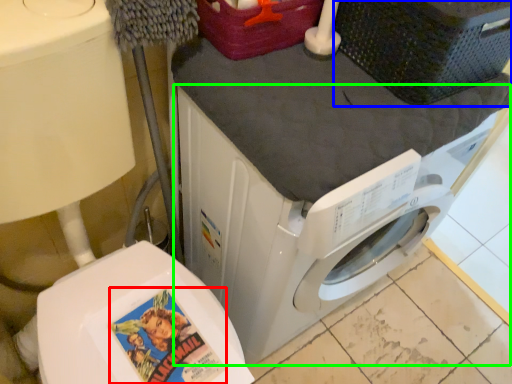
Question: Based on their relative distances, which object is nearer to comic book character (highlighted by a red box)? Choose from basket (highlighted by a blue box) and washing machine (highlighted by a green box).

Choices:
 (A) basket
 (B) washing machine

Answer: (B)